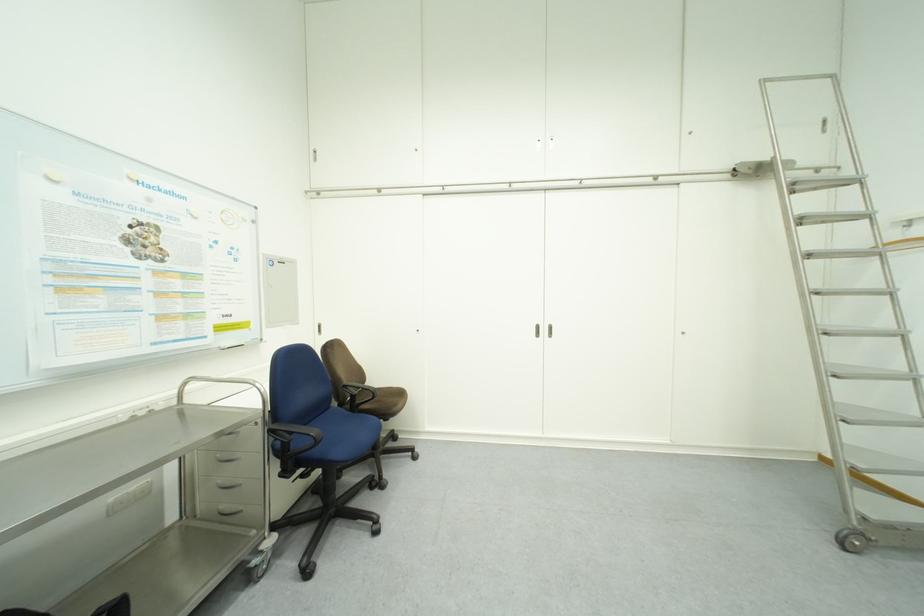
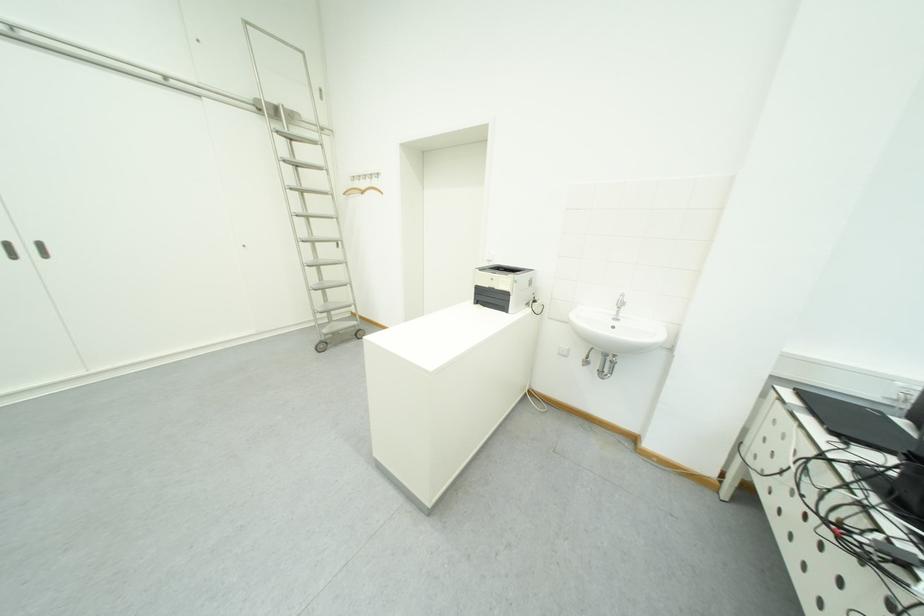
In the second image, find the point that corresponds to (x=554, y=333) in the first image.

(40, 252)